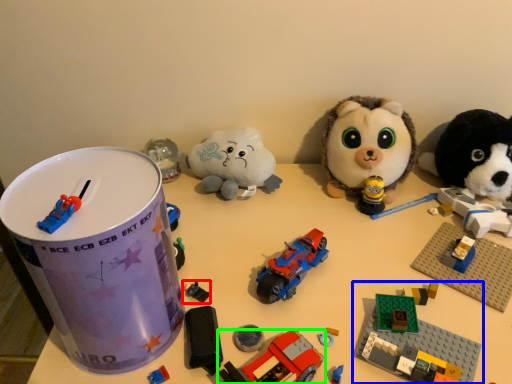
Question: Which object is the farthest from toy (highlighted by a red box)? Choose among these: toy (highlighted by a blue box) or toy (highlighted by a green box).

Choices:
 (A) toy
 (B) toy

Answer: (A)